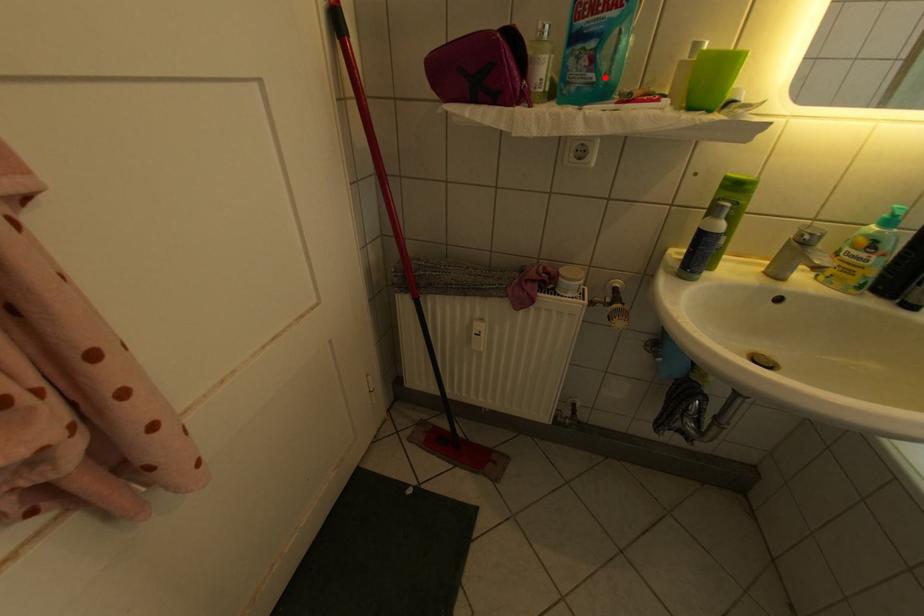
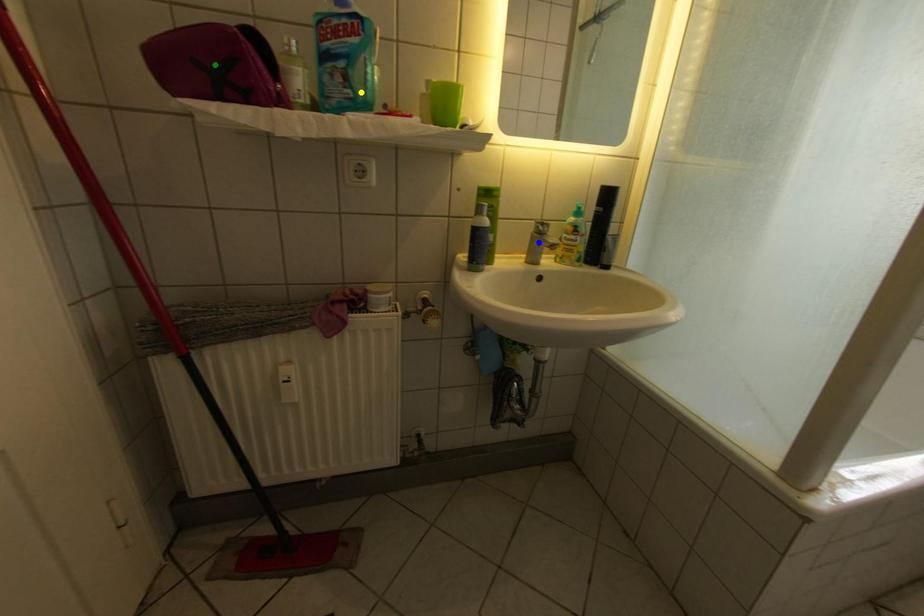
Question: I am providing you with two images of the same scene from different viewpoints. A red point is marked on the first image. You are given multiple points on the second image. Which mark in image 2 goes with the point in image 1?

Choices:
 (A) yellow point
 (B) blue point
 (C) green point

Answer: (A)